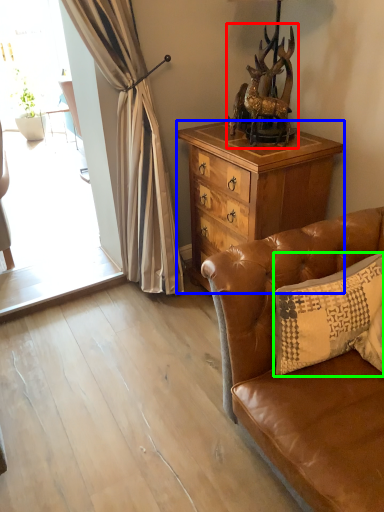
Question: Which is nearer to the animal (highlighted by a red box)? cabinetry (highlighted by a blue box) or pillow (highlighted by a green box).

Choices:
 (A) cabinetry
 (B) pillow

Answer: (A)